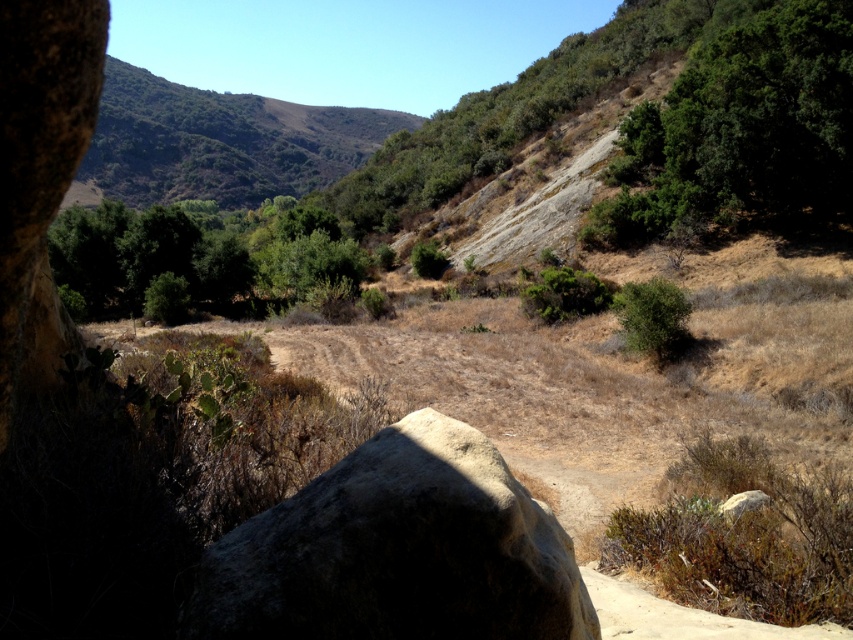
Question: Which point is closer to the camera?

Choices:
 (A) (585, 298)
 (B) (619, 320)

Answer: (B)

Question: From the image, what is the correct spatial relationship of green leafy tree at center in relation to green leafy bush at center?

Choices:
 (A) below
 (B) above

Answer: (B)

Question: Is dark gray rough boulder at center thinner than green leafy bush at center?

Choices:
 (A) yes
 (B) no

Answer: (A)

Question: Among these points, which one is farthest from the camera?

Choices:
 (A) (346, 266)
 (B) (670, 300)
 (C) (550, 323)

Answer: (A)

Question: Does dark gray rough boulder at center have a smaller size compared to green leafy tree at center?

Choices:
 (A) yes
 (B) no

Answer: (A)

Question: Which of the following is the farthest from the observer?

Choices:
 (A) green leafy shrub at center-right
 (B) green leafy tree at center
 (C) green leafy bush at center
 (D) dark gray rough boulder at center

Answer: (B)